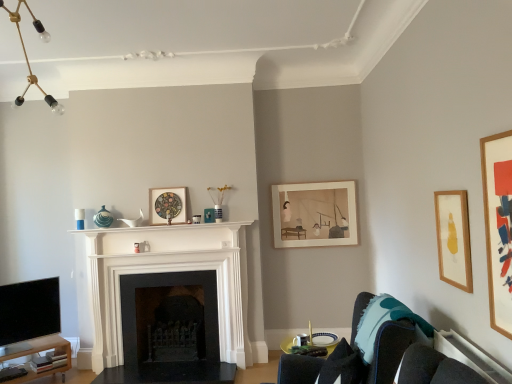
Identify the location of free region under wooden picture frame at center, arranged as the 1th picture frame when viewed from the left (from a real-world perspective). (166, 228).